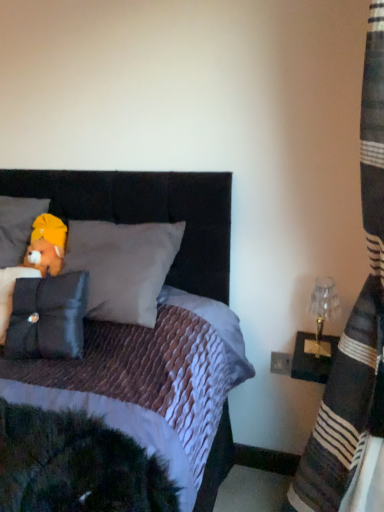
Question: Is striped fabric curtain at right not within brown plush bear at upper left?

Choices:
 (A) no
 (B) yes

Answer: (B)

Question: Is striped fabric curtain at right not close to brown plush bear at upper left?

Choices:
 (A) yes
 (B) no

Answer: (A)

Question: Could you tell me if striped fabric curtain at right is facing brown plush bear at upper left?

Choices:
 (A) no
 (B) yes

Answer: (B)

Question: Is striped fabric curtain at right taller than brown plush bear at upper left?

Choices:
 (A) no
 (B) yes

Answer: (B)

Question: From the image's perspective, does striped fabric curtain at right appear lower than brown plush bear at upper left?

Choices:
 (A) no
 (B) yes

Answer: (B)

Question: Is striped fabric curtain at right at the left side of brown plush bear at upper left?

Choices:
 (A) no
 (B) yes

Answer: (A)

Question: Is black velvet pillow at left, which appears as the 2th pillow when viewed from the top, not within velvet black headboard at upper center?

Choices:
 (A) no
 (B) yes

Answer: (A)

Question: Is black velvet pillow at left, the first pillow viewed from the front, positioned with its back to velvet black headboard at upper center?

Choices:
 (A) no
 (B) yes

Answer: (B)

Question: Would you say black velvet pillow at left, which appears as the 1th pillow when ordered from the bottom, contains velvet black headboard at upper center?

Choices:
 (A) no
 (B) yes

Answer: (A)

Question: Can you confirm if black velvet pillow at left, which appears as the 2th pillow when viewed from the top, is positioned to the left of velvet black headboard at upper center?

Choices:
 (A) no
 (B) yes

Answer: (B)

Question: Does black velvet pillow at left, which is the 2th pillow from back to front, have a greater width compared to velvet black headboard at upper center?

Choices:
 (A) yes
 (B) no

Answer: (B)

Question: Can you see black velvet pillow at left, which is the 2th pillow from back to front, touching velvet black headboard at upper center?

Choices:
 (A) yes
 (B) no

Answer: (B)

Question: From the image's perspective, is soft gray pillow at upper left, which is the 2th pillow from front to back, beneath striped fabric curtain at right?

Choices:
 (A) yes
 (B) no

Answer: (B)